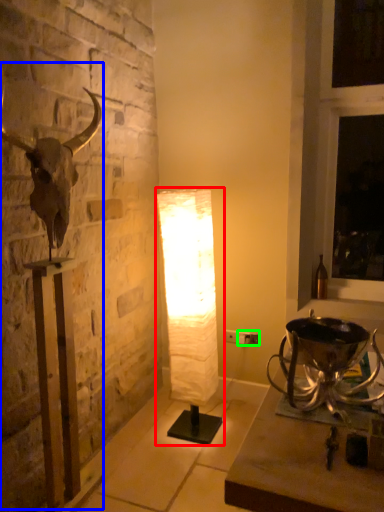
Question: Estimate the real-world distances between objects in this image. Which object is closer to lamp (highlighted by a red box), sculpture (highlighted by a blue box) or electric outlet (highlighted by a green box)?

Choices:
 (A) sculpture
 (B) electric outlet

Answer: (B)